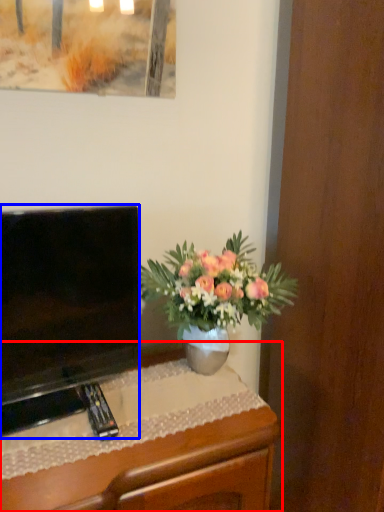
Question: Among these objects, which one is nearest to the camera, desk (highlighted by a red box) or television (highlighted by a blue box)?

Choices:
 (A) desk
 (B) television

Answer: (A)